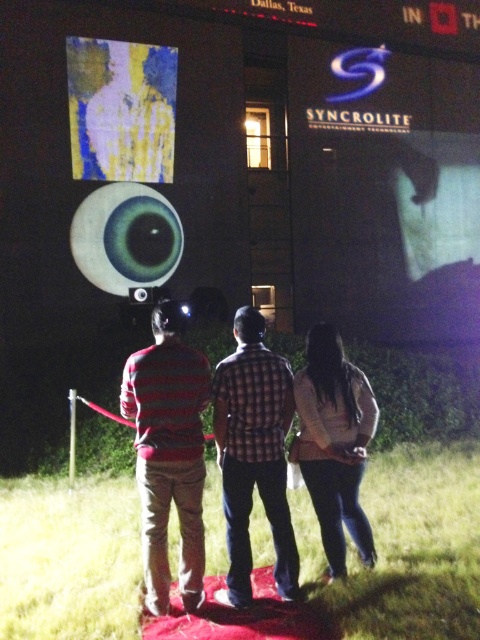
Describe the element at coordinates (120, 109) in the screenshot. The image size is (480, 640). I see `yellow fabric at upper left` at that location.

Can you confirm if yellow fabric at upper left is wider than white matte shirt at center?

Correct, the width of yellow fabric at upper left exceeds that of white matte shirt at center.

The height and width of the screenshot is (640, 480). What do you see at coordinates (120, 109) in the screenshot?
I see `yellow fabric at upper left` at bounding box center [120, 109].

The height and width of the screenshot is (640, 480). What are the coordinates of `yellow fabric at upper left` in the screenshot? It's located at click(120, 109).

Between striped sweater at center and yellow fabric at upper left, which one is positioned higher?

yellow fabric at upper left

Between striped sweater at center and yellow fabric at upper left, which one has less height?

With less height is striped sweater at center.

Is point (184, 465) farther from camera compared to point (115, 138)?

That is False.

Identify the location of striped sweater at center. (168, 452).

Does plaid shirt at center have a larger size compared to yellow fabric at upper left?

No.

Which is behind, point (276, 458) or point (112, 83)?

The point (112, 83) is more distant.

Is point (266, 445) farther from camera compared to point (73, 134)?

No, it is in front of (73, 134).

Locate an element on the screen. This screenshot has width=480, height=640. plaid shirt at center is located at coordinates (253, 454).